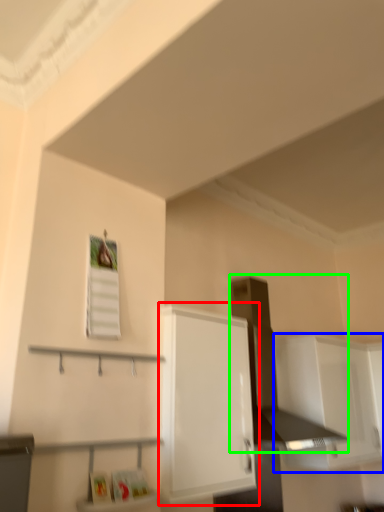
Question: Which object is the farthest from cabinetry (highlighted by a red box)? Choose among these: cabinetry (highlighted by a blue box) or vent (highlighted by a green box).

Choices:
 (A) cabinetry
 (B) vent

Answer: (A)